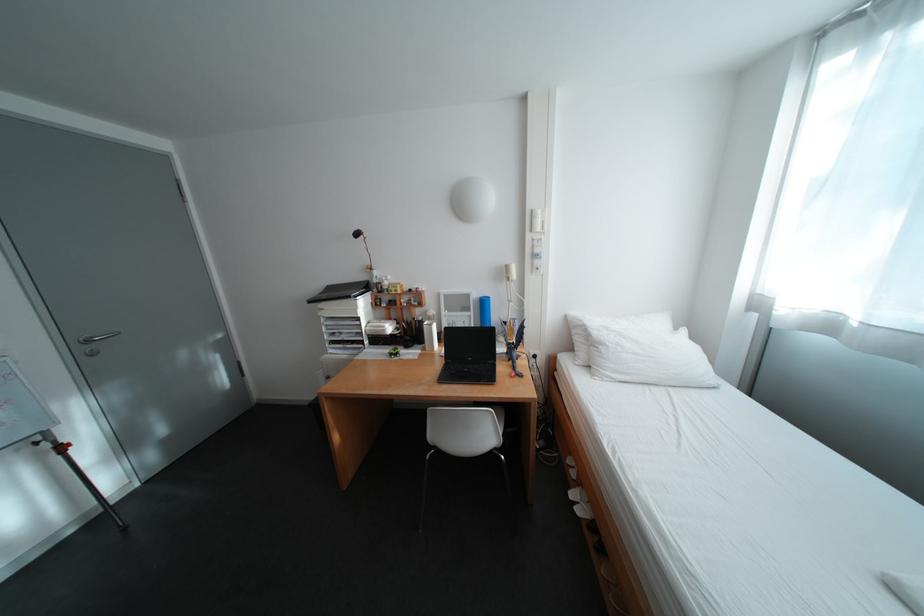
What do you see at coordinates (505, 277) in the screenshot? I see `a desk lamp head` at bounding box center [505, 277].